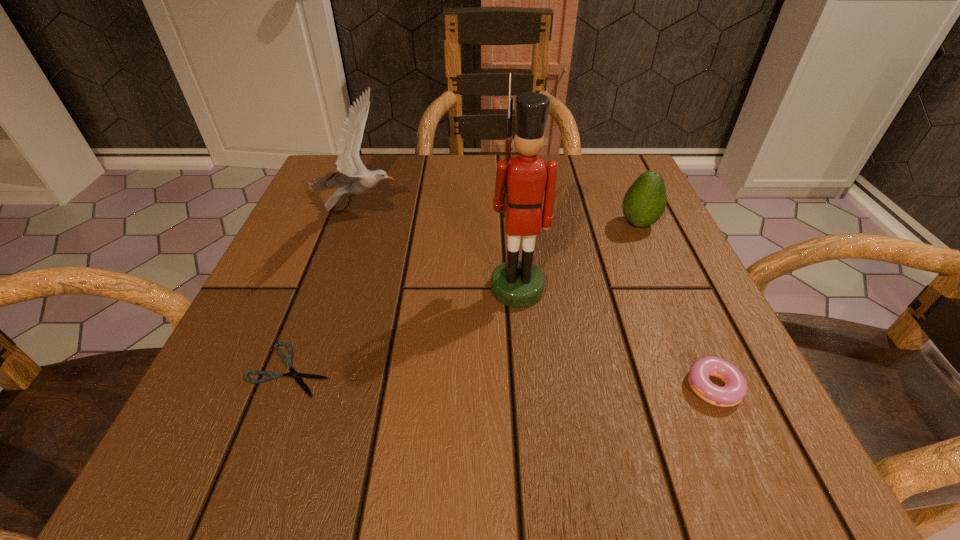
The image size is (960, 540). I want to click on free space located 0.210m on the back of the shears, so click(334, 253).

I want to click on object that is at the far edge, so click(x=353, y=177).

Locate an element on the screen. This screenshot has width=960, height=540. gull that is at the left edge is located at coordinates (353, 177).

What are the coordinates of `shears at the left edge` in the screenshot? It's located at (288, 361).

The height and width of the screenshot is (540, 960). What are the coordinates of `avocado located at the right edge` in the screenshot? It's located at (645, 201).

At what (x,y) coordinates should I click in order to perform the action: click on doughnut that is at the right edge. Please return your answer as a coordinate pair (x, y). The width and height of the screenshot is (960, 540). Looking at the image, I should click on (735, 389).

At what (x,y) coordinates should I click in order to perform the action: click on object that is at the far left corner. Please return your answer as a coordinate pair (x, y). The height and width of the screenshot is (540, 960). Looking at the image, I should click on (353, 177).

The height and width of the screenshot is (540, 960). I want to click on free space at the far edge of the desktop, so click(481, 201).

At what (x,y) coordinates should I click in order to perform the action: click on free space at the near edge of the desktop. Please return your answer as a coordinate pair (x, y). Image resolution: width=960 pixels, height=540 pixels. Looking at the image, I should click on (517, 447).

Locate an element on the screen. Image resolution: width=960 pixels, height=540 pixels. free point at the left edge is located at coordinates (348, 235).